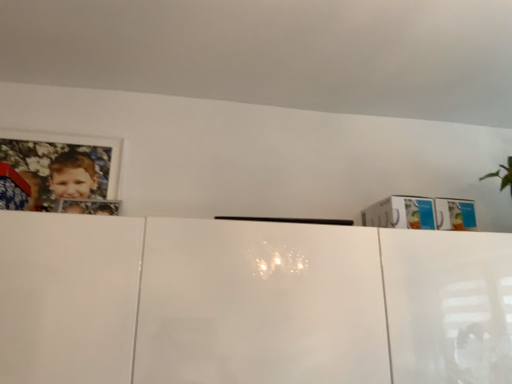
In order to face wooden photo frame at upper left, should I rotate leftwards or rightwards?

Turn left by 25.165 degrees to look at wooden photo frame at upper left.

This screenshot has height=384, width=512. What are the coordinates of `wooden photo frame at upper left` in the screenshot? It's located at click(62, 166).

Describe the element at coordinates (62, 166) in the screenshot. The height and width of the screenshot is (384, 512). I see `wooden photo frame at upper left` at that location.

The width and height of the screenshot is (512, 384). Identify the location of wooden photo frame at upper left. (62, 166).